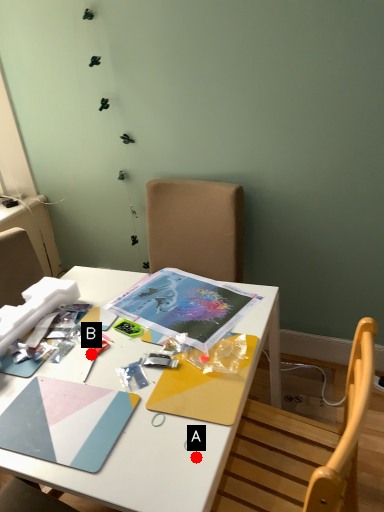
Question: Two points are circled on the image, labeled by A and B beside each circle. Which point is farther to the camera?

Choices:
 (A) A is further
 (B) B is further

Answer: (B)